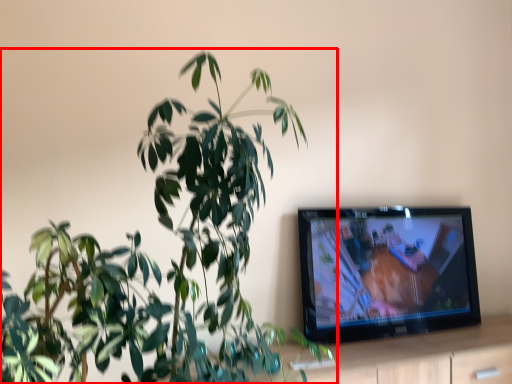
Question: Observing the image, what is the correct spatial positioning of houseplant (annotated by the red box) in reference to dresser?

Choices:
 (A) right
 (B) left

Answer: (B)